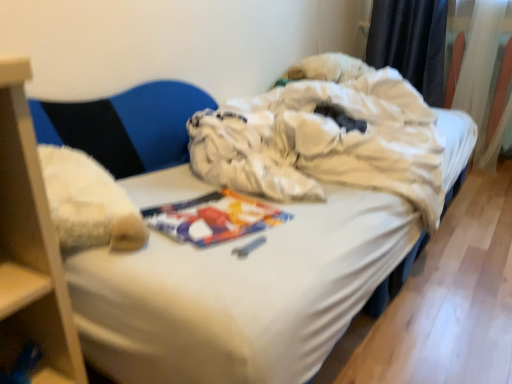
Question: From the image's perspective, is white sheer curtain at upper right, which is the 1th curtain from right to left, beneath black fabric curtain at upper right, marked as the first curtain in a left-to-right arrangement?

Choices:
 (A) yes
 (B) no

Answer: (A)

Question: Would you say white sheer curtain at upper right, the 2th curtain in the left-to-right sequence, is a long distance from black fabric curtain at upper right, which is counted as the second curtain, starting from the right?

Choices:
 (A) no
 (B) yes

Answer: (A)

Question: Could you tell me if white sheer curtain at upper right, the 2th curtain in the left-to-right sequence, is facing black fabric curtain at upper right, marked as the first curtain in a left-to-right arrangement?

Choices:
 (A) no
 (B) yes

Answer: (A)

Question: Considering the relative sizes of white sheer curtain at upper right, which is the 1th curtain from right to left, and black fabric curtain at upper right, marked as the first curtain in a left-to-right arrangement, in the image provided, is white sheer curtain at upper right, which is the 1th curtain from right to left, thinner than black fabric curtain at upper right, marked as the first curtain in a left-to-right arrangement,?

Choices:
 (A) no
 (B) yes

Answer: (A)

Question: Can black fabric curtain at upper right, marked as the first curtain in a left-to-right arrangement, be found inside white sheer curtain at upper right, the 2th curtain in the left-to-right sequence?

Choices:
 (A) no
 (B) yes

Answer: (A)

Question: Is white fabric bed at center inside the boundaries of black fabric curtain at upper right, which is counted as the second curtain, starting from the right, or outside?

Choices:
 (A) outside
 (B) inside

Answer: (A)

Question: Considering the positions of white fabric bed at center and black fabric curtain at upper right, marked as the first curtain in a left-to-right arrangement, in the image, is white fabric bed at center taller or shorter than black fabric curtain at upper right, marked as the first curtain in a left-to-right arrangement,?

Choices:
 (A) short
 (B) tall

Answer: (A)

Question: From a real-world perspective, is white fabric bed at center positioned above or below black fabric curtain at upper right, marked as the first curtain in a left-to-right arrangement?

Choices:
 (A) below
 (B) above

Answer: (A)

Question: From the image's perspective, is white fabric bed at center positioned above or below black fabric curtain at upper right, which is counted as the second curtain, starting from the right?

Choices:
 (A) below
 (B) above

Answer: (A)

Question: Is point (483, 97) positioned closer to the camera than point (134, 122)?

Choices:
 (A) farther
 (B) closer

Answer: (A)

Question: Do you think white sheer curtain at upper right, the 2th curtain in the left-to-right sequence, is within fuzzy fabric armchair at left, or outside of it?

Choices:
 (A) outside
 (B) inside

Answer: (A)

Question: Visually, is white sheer curtain at upper right, which is the 1th curtain from right to left, positioned to the left or to the right of fuzzy fabric armchair at left?

Choices:
 (A) left
 (B) right

Answer: (B)

Question: Considering their positions, is white sheer curtain at upper right, the 2th curtain in the left-to-right sequence, located in front of or behind fuzzy fabric armchair at left?

Choices:
 (A) front
 (B) behind

Answer: (B)

Question: Is point (137, 304) positioned closer to the camera than point (505, 119)?

Choices:
 (A) closer
 (B) farther

Answer: (A)

Question: Is white fabric bed at center situated inside white sheer curtain at upper right, the 2th curtain in the left-to-right sequence, or outside?

Choices:
 (A) outside
 (B) inside

Answer: (A)